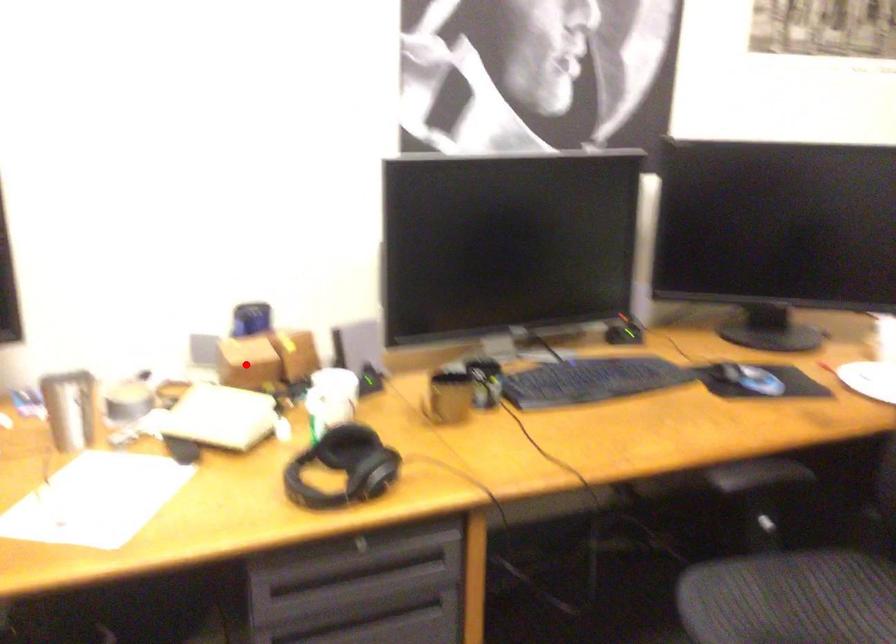
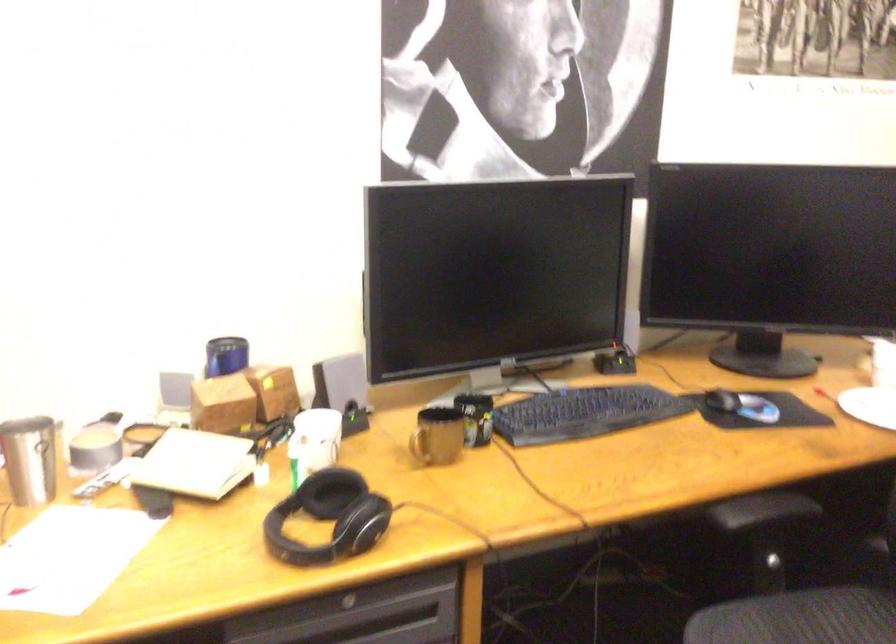
Locate, in the second image, the point that corresponds to the highlighted location in the first image.

(222, 404)